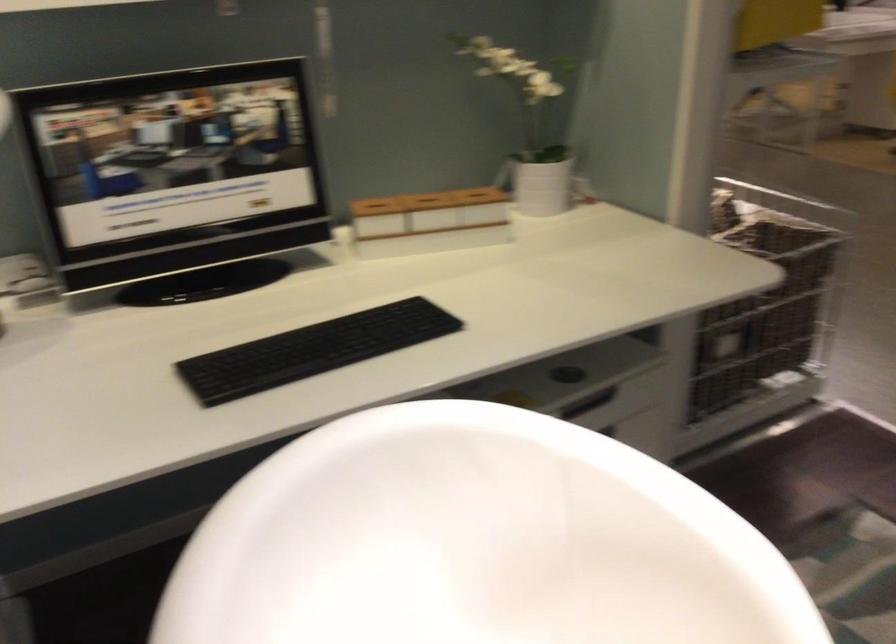
What do you see at coordinates (460, 614) in the screenshot?
I see `the white chair sitting surface` at bounding box center [460, 614].